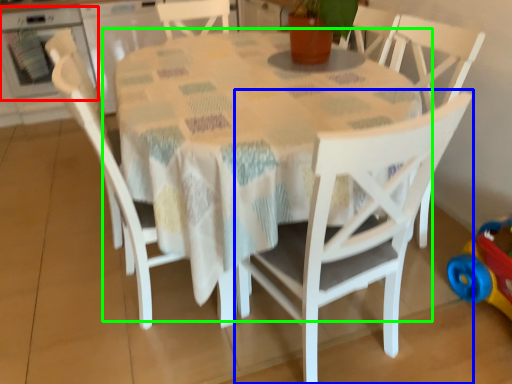
Question: Estimate the real-world distances between objects in this image. Which object is closer to oven (highlighted by a red box), chair (highlighted by a blue box) or table (highlighted by a green box)?

Choices:
 (A) chair
 (B) table

Answer: (B)